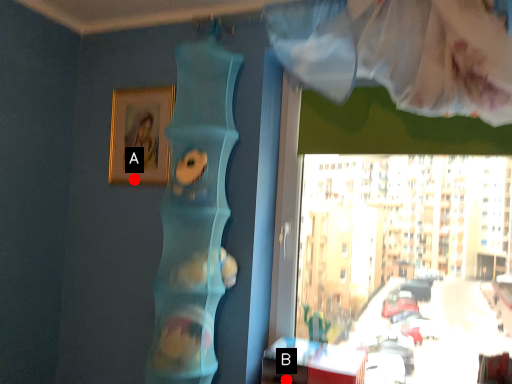
Question: Two points are circled on the image, labeled by A and B beside each circle. Which point is farther to the camera?

Choices:
 (A) A is further
 (B) B is further

Answer: (A)